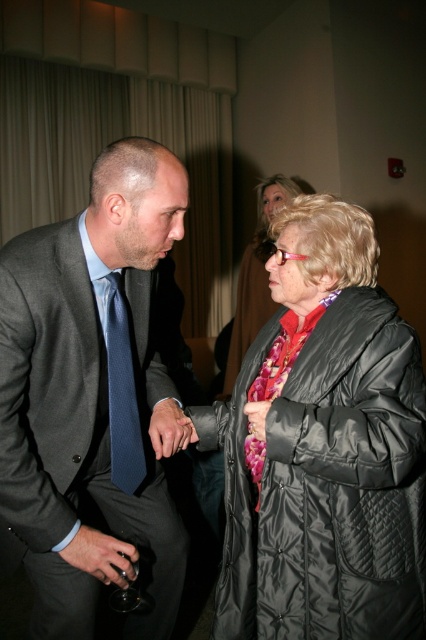
From the picture: Which is more to the right, shiny black coat at center or matte black wine glass at lower left?

From the viewer's perspective, shiny black coat at center appears more on the right side.

The width and height of the screenshot is (426, 640). What do you see at coordinates (256, 276) in the screenshot?
I see `shiny black coat at center` at bounding box center [256, 276].

Is point (259, 294) less distant than point (98, 572)?

No, it is behind (98, 572).

Where is `shiny black coat at center`? shiny black coat at center is located at coordinates (256, 276).

From the picture: Is dark gray suit at center shorter than matte black wine glass at lower left?

Incorrect, dark gray suit at center's height does not fall short of matte black wine glass at lower left's.

Describe the element at coordinates (91, 396) in the screenshot. Image resolution: width=426 pixels, height=640 pixels. I see `dark gray suit at center` at that location.

Locate an element on the screen. dark gray suit at center is located at coordinates (91, 396).

Which is in front, point (118, 342) or point (267, 308)?

Positioned in front is point (118, 342).

The width and height of the screenshot is (426, 640). What are the coordinates of `matte blue tie at left` in the screenshot? It's located at (121, 394).